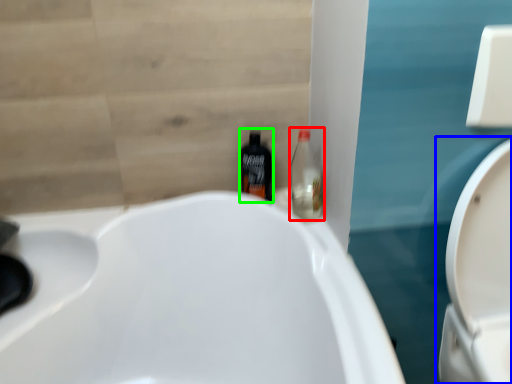
Question: Which object is the farthest from bottle (highlighted by a red box)? Choose among these: toilet (highlighted by a blue box) or bottle (highlighted by a green box).

Choices:
 (A) toilet
 (B) bottle

Answer: (A)